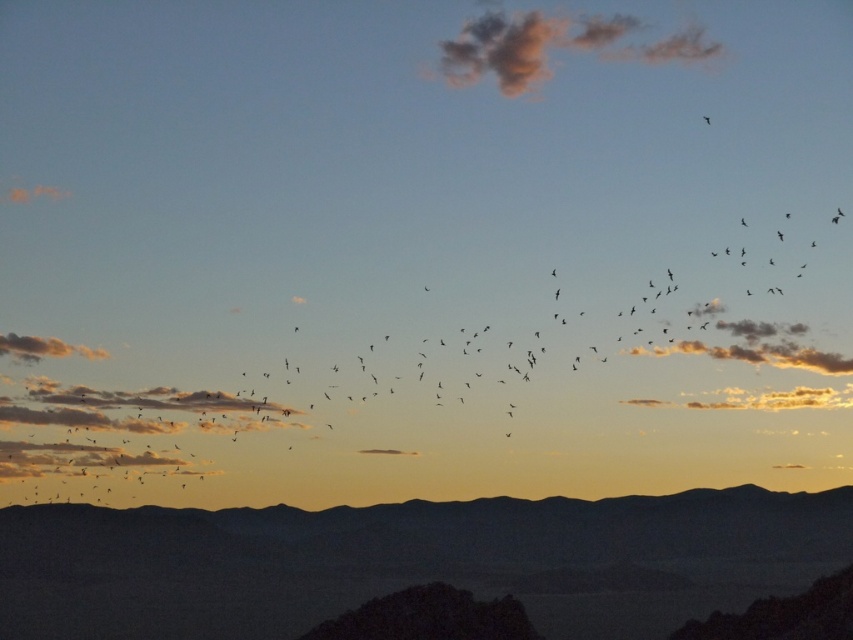
Question: Which of these objects is positioned closest to the silhouetted rock at lower center?

Choices:
 (A) black matte bird at upper right
 (B) orange cotton cloud at upper left
 (C) dark gray textured cloud at right

Answer: (C)

Question: Estimate the real-world distances between objects in this image. Which object is farther from the white cotton cloud at center?

Choices:
 (A) orange cotton cloud at upper left
 (B) black matte bird at upper right
 (C) soft pink cotton cloud at upper center

Answer: (B)

Question: Which of the following is the farthest from the observer?

Choices:
 (A) dark gray textured cloud at right
 (B) silhouetted rock at lower center

Answer: (A)

Question: Is silhouetted rock at lower center smaller than soft pink cotton cloud at upper center?

Choices:
 (A) yes
 (B) no

Answer: (B)

Question: Is dark gray textured cloud at right to the right of white cotton cloud at center from the viewer's perspective?

Choices:
 (A) yes
 (B) no

Answer: (A)

Question: Does soft pink cotton cloud at upper center appear on the right side of orange cotton cloud at upper left?

Choices:
 (A) yes
 (B) no

Answer: (A)